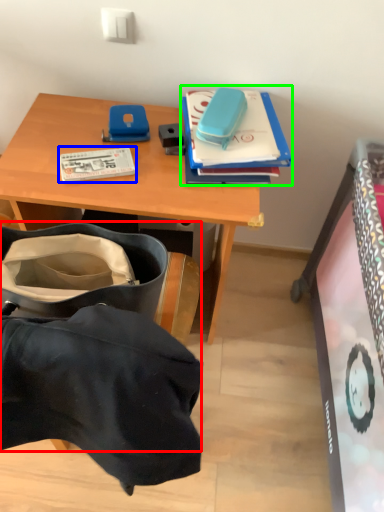
Question: Which object is the farthest from luggage and bags (highlighted by a red box)? Choose among these: book (highlighted by a blue box) or book (highlighted by a green box).

Choices:
 (A) book
 (B) book

Answer: (B)